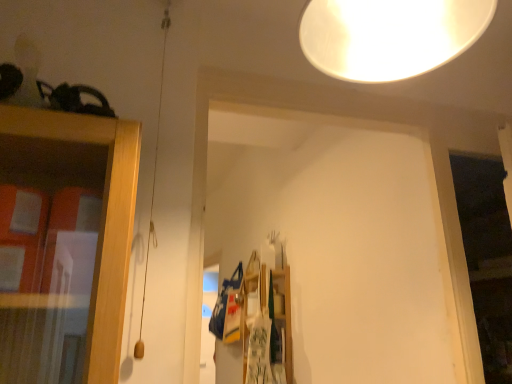
Question: Could white glossy lampshade at upper center be considered to be inside wooden at center?

Choices:
 (A) no
 (B) yes

Answer: (A)

Question: Is wooden at center facing towards white glossy lampshade at upper center?

Choices:
 (A) no
 (B) yes

Answer: (A)

Question: Does wooden at center have a larger size compared to white glossy lampshade at upper center?

Choices:
 (A) no
 (B) yes

Answer: (B)

Question: Is wooden at center at the right side of white glossy lampshade at upper center?

Choices:
 (A) yes
 (B) no

Answer: (B)

Question: From a real-world perspective, is wooden at center on top of white glossy lampshade at upper center?

Choices:
 (A) yes
 (B) no

Answer: (B)

Question: Does wooden at center lie behind white glossy lampshade at upper center?

Choices:
 (A) yes
 (B) no

Answer: (A)

Question: From the image's perspective, does white glossy lampshade at upper center appear lower than wooden at center?

Choices:
 (A) yes
 (B) no

Answer: (B)

Question: Considering the relative sizes of white glossy lampshade at upper center and wooden at center in the image provided, is white glossy lampshade at upper center smaller than wooden at center?

Choices:
 (A) no
 (B) yes

Answer: (B)

Question: Considering the relative sizes of white glossy lampshade at upper center and wooden at center in the image provided, is white glossy lampshade at upper center thinner than wooden at center?

Choices:
 (A) no
 (B) yes

Answer: (B)

Question: Would you say white glossy lampshade at upper center is a long distance from wooden at center?

Choices:
 (A) no
 (B) yes

Answer: (B)

Question: Considering the relative sizes of white glossy lampshade at upper center and wooden at center in the image provided, is white glossy lampshade at upper center wider than wooden at center?

Choices:
 (A) no
 (B) yes

Answer: (A)

Question: Is white glossy lampshade at upper center positioned with its back to wooden at center?

Choices:
 (A) yes
 (B) no

Answer: (A)

Question: Considering their positions, is wooden at center located in front of or behind white glossy lampshade at upper center?

Choices:
 (A) behind
 (B) front

Answer: (A)